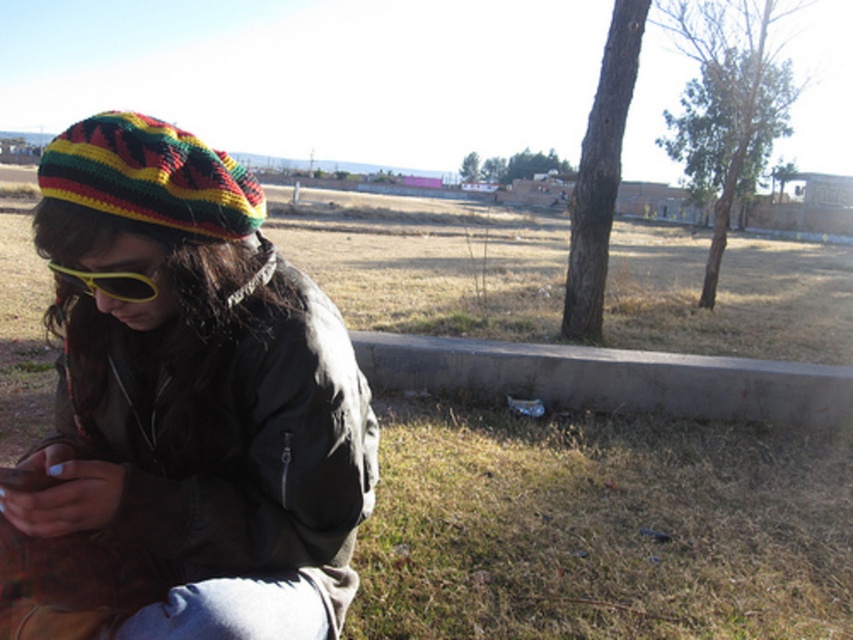
Can you confirm if knitted woolen beanie at upper left is positioned below gray concrete curb at lower center?

Yes, knitted woolen beanie at upper left is below gray concrete curb at lower center.

Is point (99, 316) positioned behind point (798, 397)?

No, (99, 316) is closer to viewer.

Where is `knitted woolen beanie at upper left`? The image size is (853, 640). knitted woolen beanie at upper left is located at coordinates (184, 412).

From the picture: Who is more distant from viewer, (x=436, y=253) or (x=453, y=352)?

Point (x=436, y=253)

Does green grass at lower center have a greater height compared to gray concrete curb at lower center?

Yes.

Is point (640, 493) behind point (784, 404)?

No.

Locate an element on the screen. green grass at lower center is located at coordinates (601, 525).

How far apart are gray concrete curb at lower center and knitted/rasta-patterned hat at upper left?

They are 3.70 meters apart.

Where is `gray concrete curb at lower center`? This screenshot has height=640, width=853. gray concrete curb at lower center is located at coordinates coord(608,378).